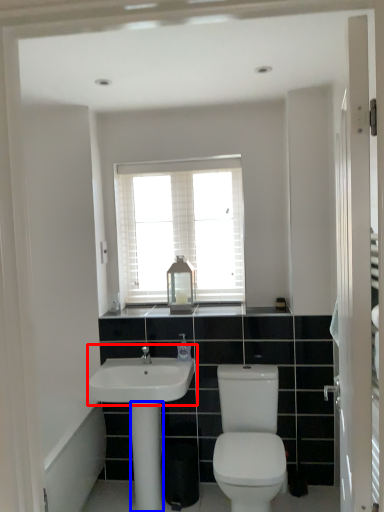
Question: Which of the following is the farthest to the observer, sink (highlighted by a red box) or pillar (highlighted by a blue box)?

Choices:
 (A) sink
 (B) pillar

Answer: (B)